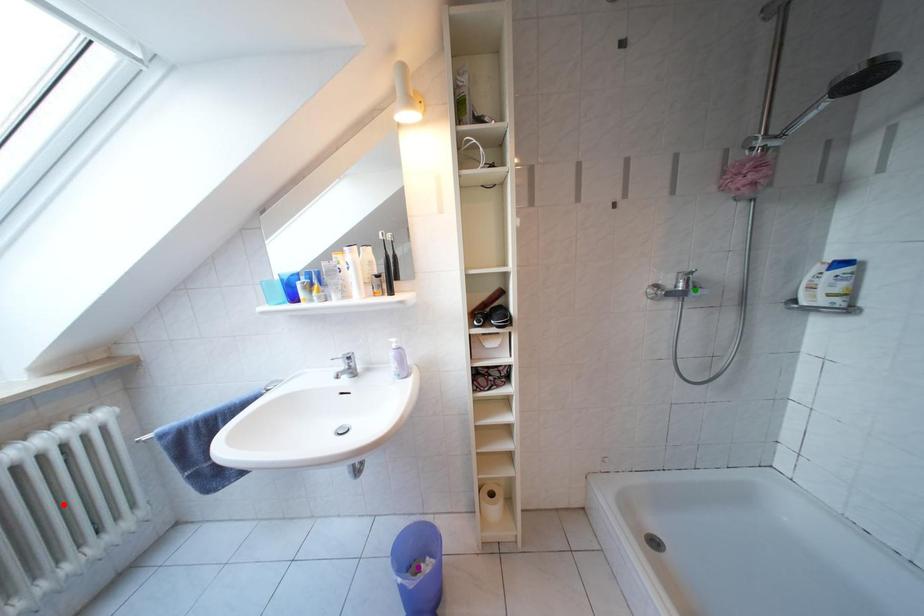
Order these from nearest to farthest:
1. purple point
2. green point
3. red point

red point → green point → purple point